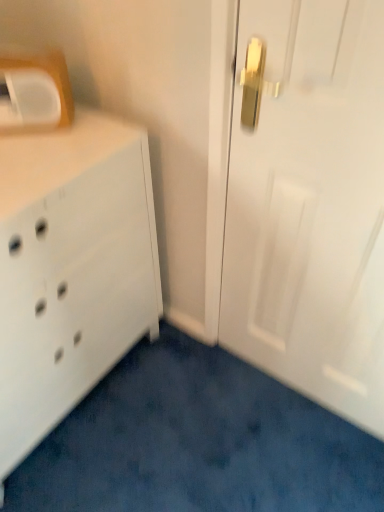
Question: Can you confirm if white plastic medicine cabinet at upper left is taller than white glossy door at center?

Choices:
 (A) yes
 (B) no

Answer: (B)

Question: Can you confirm if white plastic medicine cabinet at upper left is smaller than white glossy door at center?

Choices:
 (A) no
 (B) yes

Answer: (B)

Question: Does white plastic medicine cabinet at upper left turn towards white glossy door at center?

Choices:
 (A) yes
 (B) no

Answer: (B)

Question: Is white plastic medicine cabinet at upper left facing away from white glossy door at center?

Choices:
 (A) no
 (B) yes

Answer: (A)

Question: Does white plastic medicine cabinet at upper left appear on the right side of white glossy door at center?

Choices:
 (A) no
 (B) yes

Answer: (A)

Question: In terms of height, does white matte chest of drawers at left look taller or shorter compared to white plastic medicine cabinet at upper left?

Choices:
 (A) tall
 (B) short

Answer: (A)

Question: Is point (132, 251) closer or farther from the camera than point (1, 114)?

Choices:
 (A) closer
 (B) farther

Answer: (B)

Question: From the image's perspective, is white matte chest of drawers at left above or below white plastic medicine cabinet at upper left?

Choices:
 (A) below
 (B) above

Answer: (A)

Question: From a real-world perspective, is white matte chest of drawers at left positioned above or below white plastic medicine cabinet at upper left?

Choices:
 (A) above
 (B) below

Answer: (B)

Question: Based on their sizes in the image, would you say white glossy door at center is bigger or smaller than white plastic medicine cabinet at upper left?

Choices:
 (A) big
 (B) small

Answer: (A)

Question: In terms of height, does white glossy door at center look taller or shorter compared to white plastic medicine cabinet at upper left?

Choices:
 (A) tall
 (B) short

Answer: (A)

Question: From the image's perspective, is white glossy door at center located above or below white plastic medicine cabinet at upper left?

Choices:
 (A) above
 (B) below

Answer: (B)

Question: From a real-world perspective, is white glossy door at center above or below white plastic medicine cabinet at upper left?

Choices:
 (A) below
 (B) above

Answer: (A)

Question: Considering their positions, is white matte chest of drawers at left located in front of or behind white glossy door at center?

Choices:
 (A) front
 (B) behind

Answer: (B)

Question: From a real-world perspective, is white matte chest of drawers at left physically located above or below white glossy door at center?

Choices:
 (A) below
 (B) above

Answer: (A)